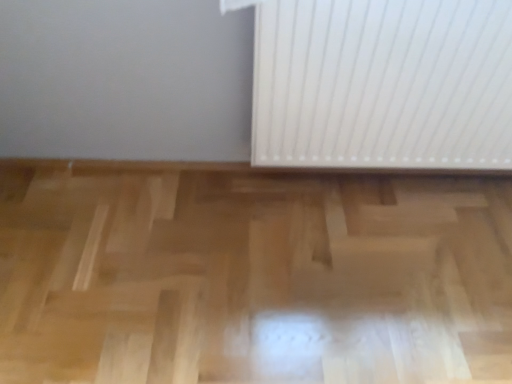
The image size is (512, 384). What do you see at coordinates (383, 84) in the screenshot?
I see `white plastic radiator at right` at bounding box center [383, 84].

At what (x,y) coordinates should I click in order to perform the action: click on white plastic radiator at right. Please return your answer as a coordinate pair (x, y). Image resolution: width=512 pixels, height=384 pixels. Looking at the image, I should click on (383, 84).

The width and height of the screenshot is (512, 384). I want to click on white plastic radiator at right, so click(x=383, y=84).